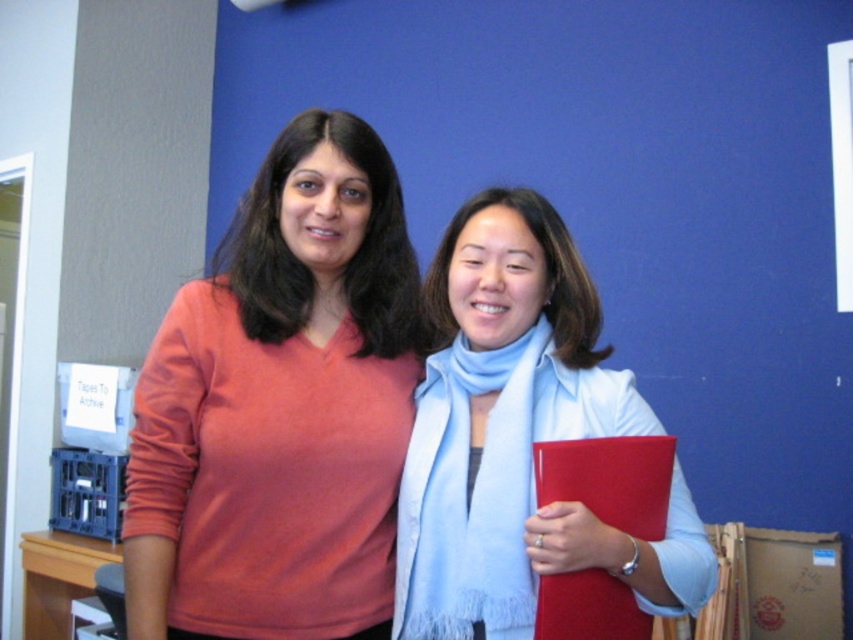
Can you confirm if matte orange sweater at center is positioned below light blue scarf at center?

No.

Does matte orange sweater at center appear on the right side of light blue scarf at center?

Incorrect, matte orange sweater at center is not on the right side of light blue scarf at center.

This screenshot has width=853, height=640. What are the coordinates of `matte orange sweater at center` in the screenshot? It's located at (280, 406).

Which is below, light blue scarf at center or light blue soft scarf at center?

light blue soft scarf at center is below.

Is light blue scarf at center above light blue soft scarf at center?

Indeed, light blue scarf at center is positioned over light blue soft scarf at center.

This screenshot has width=853, height=640. What are the coordinates of `light blue scarf at center` in the screenshot? It's located at (520, 436).

Is matte orange sweater at center positioned in front of light blue soft scarf at center?

No, it is behind light blue soft scarf at center.

Who is positioned more to the right, matte orange sweater at center or light blue soft scarf at center?

Positioned to the right is light blue soft scarf at center.

Where is `matte orange sweater at center`? The width and height of the screenshot is (853, 640). matte orange sweater at center is located at coordinates (280, 406).